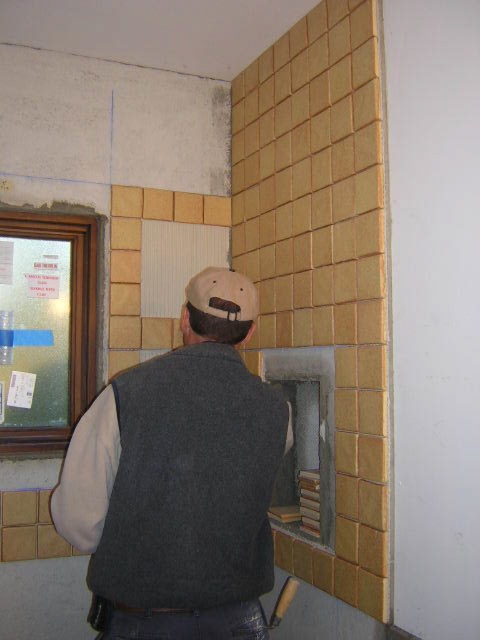
You are a construction worker observing the scene. You need to determine which object is bigger between the dark gray wool vest at center and the wooden handle hammer at lower center. Which one is larger?

The dark gray wool vest at center is larger in size than the wooden handle hammer at lower center.

You are an inspector checking the safety of the construction site. You notice the fuzzy beige baseball hat at upper center is located at coordinates point 0.461, 0.465. What is the position of the hat relative to the camera?

The fuzzy beige baseball hat at upper center is positioned at point (223, 294) relative to the camera.